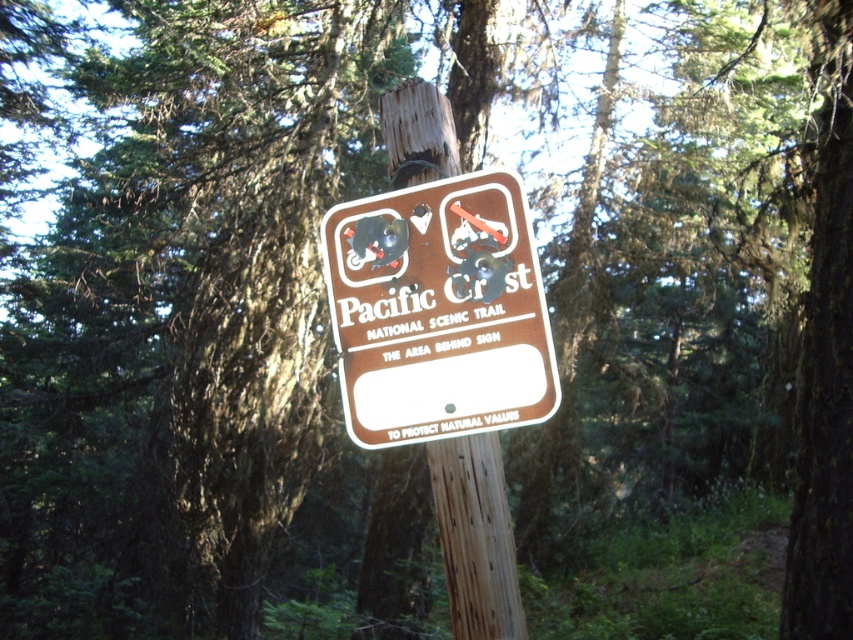
You are a hiker planning to take a photo of the brown matte sign at center and the brown wood pole at center. Which object should you focus on first if you want to capture both in a single frame without moving the camera? Explain your reasoning based on their sizes.

The brown matte sign at center has a larger width than the brown wood pole at center. Since the sign is wider, focusing on it first ensures that both objects fit within the camera frame without needing to adjust the camera position.

You are a hiker standing at the signpost in the forest. You notice two points marked on the ground near the signpost. The first point is at coordinates point (361, 403) and the second is at point (508, 618). If you want to avoid disturbing the protected natural area behind the sign, which point should you stay closer to?

You should stay closer to point (508, 618) because point (361, 403) is behind point (508, 618), and the area behind the sign is protected. Staying near point (508, 618) keeps you away from the protected area.

You are a hiker who wants to know if the brown matte sign at center is attached to the brown wood pole at center. Based on the scene description, can you confirm this?

The brown matte sign at center is above brown wood pole at center, so yes, it is likely attached to it since it is positioned on top of the pole.